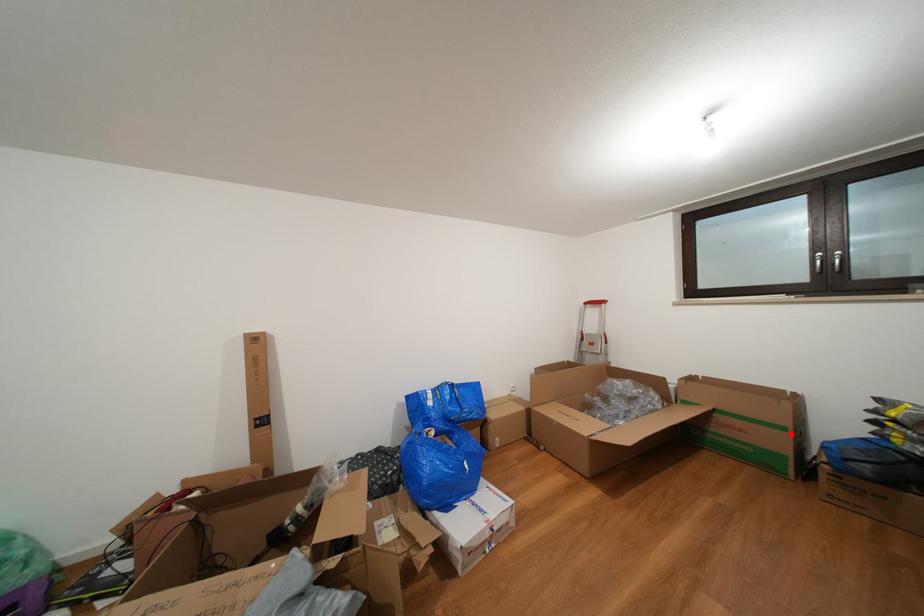
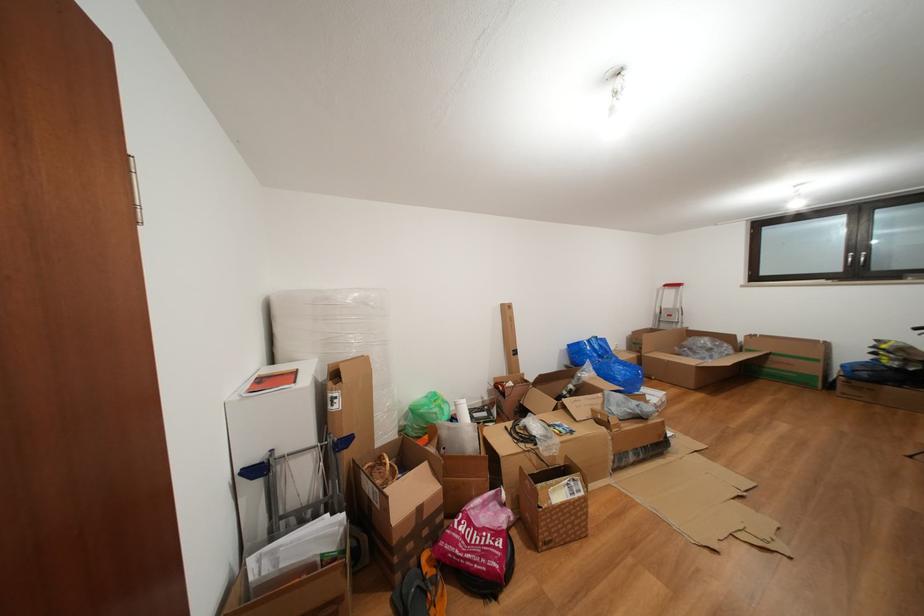
Locate, in the second image, the point that corresponds to the highlighted location in the first image.

(824, 366)